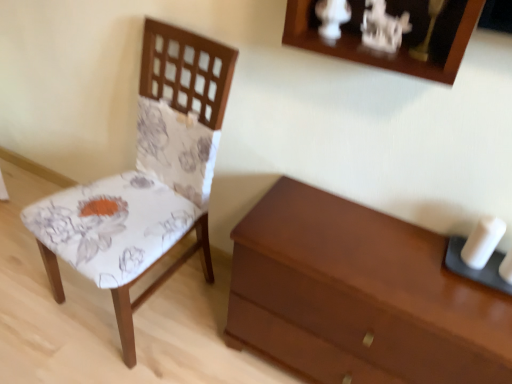
Locate an element on the screen. The image size is (512, 384). free region under floral fabric chair at left (from a real-world perspective) is located at coordinates (134, 310).